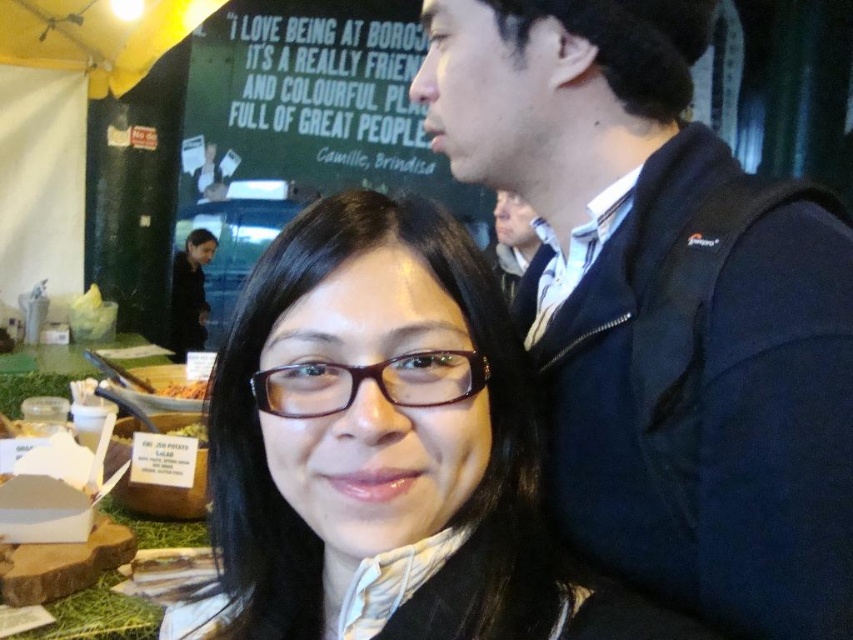
Question: Does dark blue jacket at upper right appear on the right side of matte black jacket at upper right?

Choices:
 (A) no
 (B) yes

Answer: (A)

Question: Which point is farther from the camera taking this photo?

Choices:
 (A) (497, 196)
 (B) (386, 380)

Answer: (A)

Question: Which of these objects is positioned farthest from the matte black jacket at upper right?

Choices:
 (A) wooden bowl at center
 (B) brown matte glasses at center

Answer: (B)

Question: Can you confirm if brown matte glasses at center is smaller than wooden bowl at center?

Choices:
 (A) yes
 (B) no

Answer: (B)

Question: Which of these objects is positioned closest to the wooden bowl at center?

Choices:
 (A) dark blue jacket at upper right
 (B) brown matte glasses at center
 (C) matte black jacket at upper right

Answer: (B)

Question: Is brown matte glasses at center to the right of wooden bowl at center from the viewer's perspective?

Choices:
 (A) yes
 (B) no

Answer: (A)